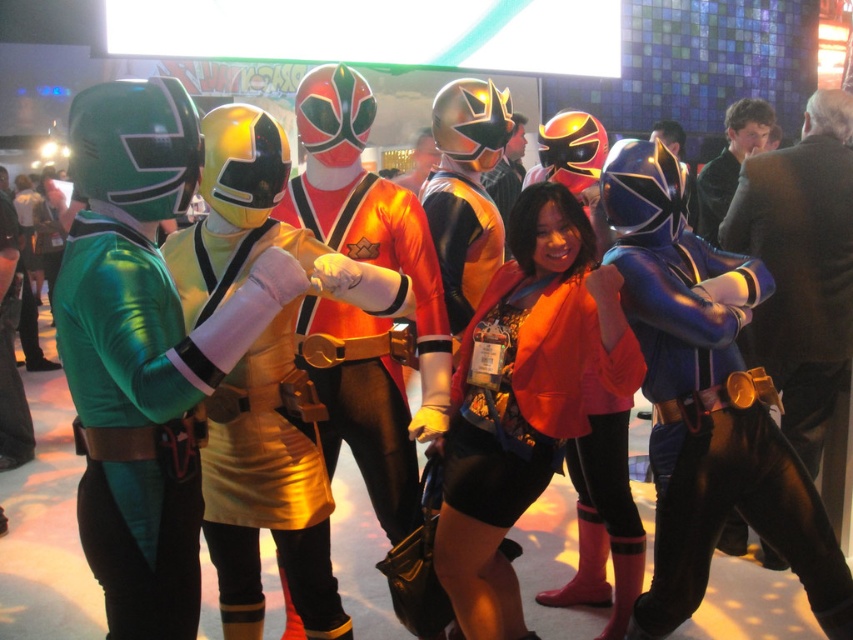
Looking at this image, can you confirm if matte orange jacket at center is taller than shiny orange costume at center?

In fact, matte orange jacket at center may be shorter than shiny orange costume at center.

Does point (538, 406) come closer to viewer compared to point (321, 220)?

Yes.

You are a GUI agent. You are given a task and a screenshot of the screen. Output one action in this format:
    pyautogui.click(x=<x>, y=<y>)
    Task: Click on the matte orange jacket at center
    The image size is (853, 640).
    Given the screenshot: What is the action you would take?
    pyautogui.click(x=524, y=400)

The image size is (853, 640). What are the coordinates of `matte orange jacket at center` in the screenshot? It's located at (524, 400).